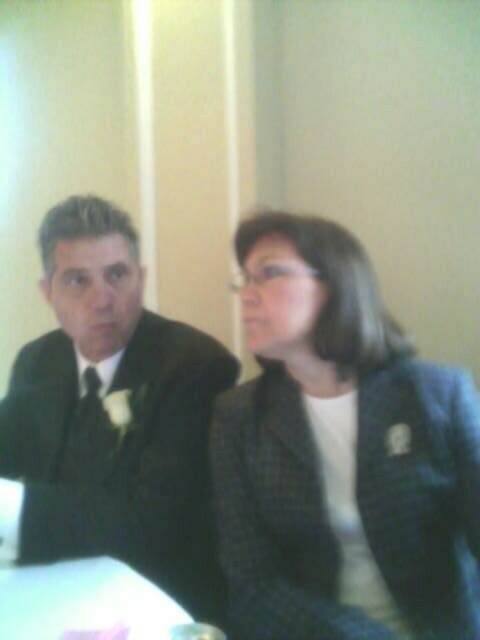
Can you confirm if dark gray textured blazer at center is thinner than matte black suit at left?

Correct, dark gray textured blazer at center's width is less than matte black suit at left's.

You are a GUI agent. You are given a task and a screenshot of the screen. Output one action in this format:
    pyautogui.click(x=<x>, y=<y>)
    Task: Click on the dark gray textured blazer at center
    
    Given the screenshot: What is the action you would take?
    pyautogui.click(x=340, y=454)